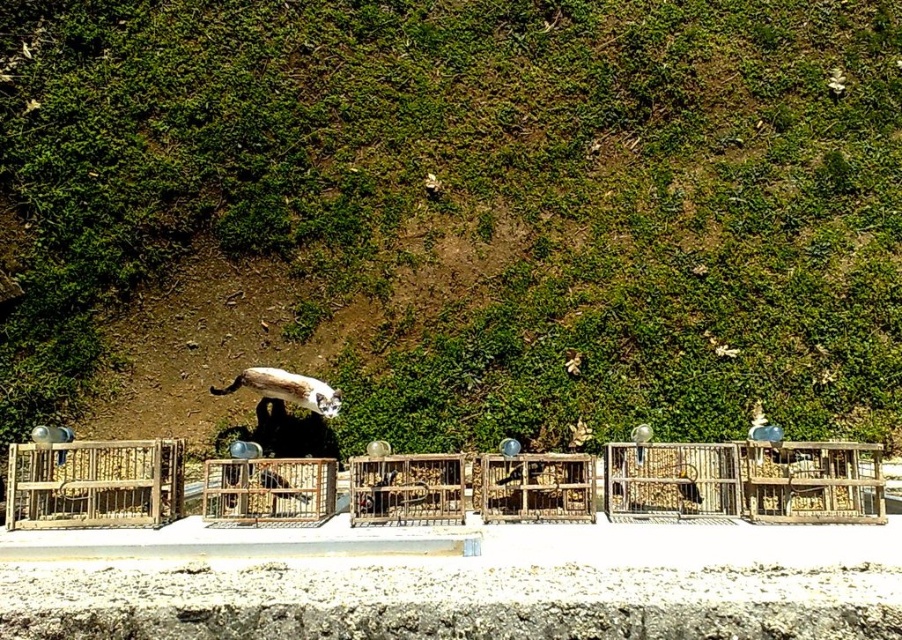
Question: Does wooden birdcages at center have a smaller size compared to wooden birdcage at center?

Choices:
 (A) no
 (B) yes

Answer: (A)

Question: Among these objects, which one is nearest to the camera?

Choices:
 (A) wooden birdcage at left
 (B) wooden birdcages at center

Answer: (B)

Question: Which of these objects is positioned farthest from the wooden birdcage at left?

Choices:
 (A) wooden birdcage at center
 (B) wooden birdcages at center

Answer: (B)

Question: Does wooden birdcage at left have a larger size compared to wooden birdcage at center?

Choices:
 (A) no
 (B) yes

Answer: (B)

Question: In this image, where is wooden birdcages at center located relative to wooden birdcage at center?

Choices:
 (A) below
 (B) above

Answer: (A)

Question: Which object is positioned closest to the wooden birdcage at center?

Choices:
 (A) wooden birdcage at left
 (B) wooden birdcages at center

Answer: (B)